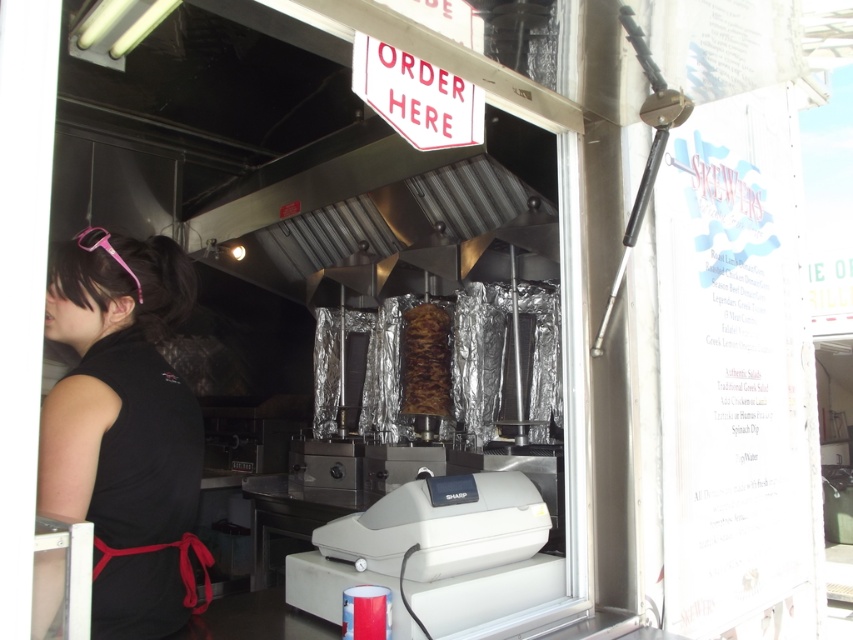
You are standing in front of the food truck and notice two points marked on the menu board. The first point is at coordinates point (120,438) and the second is at point (424,344). Which point is closer to you?

Point (120,438) is closer to the camera than point (424,344), so it is the closer point.